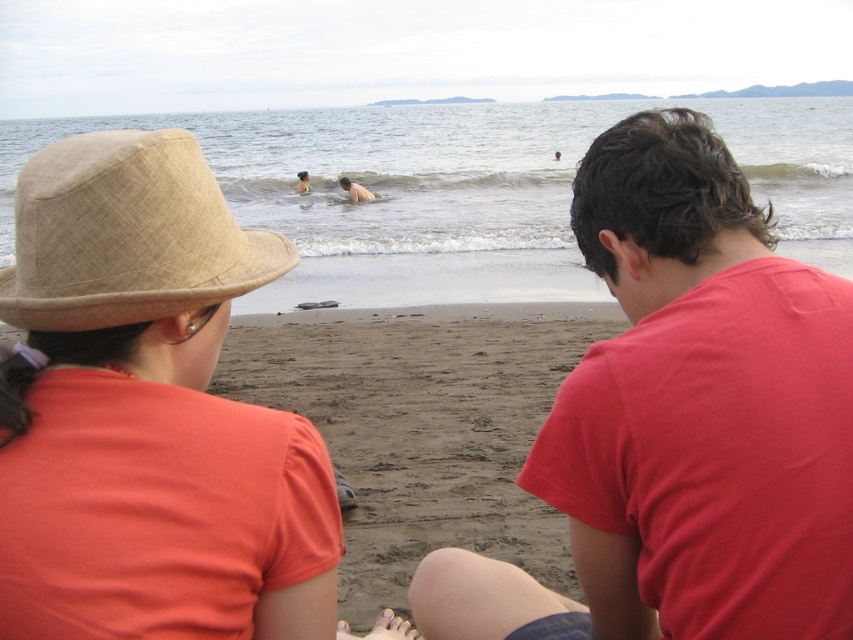
You are standing at the center of the image. Which direction should you move to reach the brown sandy beach at center?

The brown sandy beach at center is located at point coordinates of 0.667 on the x axis and 0.497 on the y axis. Since you are already at the center of the image, you are already standing on the brown sandy beach at center.

Consider the image. You are planning to set up a small tent on the brown sandy beach at center. However, there is a beige woven hat at upper left nearby. Based on the scene, can the tent be placed between these two objects without overlapping them?

The brown sandy beach at center might be wider than beige woven hat at upper left, so there might be enough space to place the tent between them without overlapping. However, the exact distance isn

You are a photographer trying to capture the perfect shot of the two people on the brown sandy beach at center and the naked skin at center. Since you want to include both subjects in the frame, which subject should you position closer to the left side of the camera to ensure both fit in the shot?

The brown sandy beach at center is to the right of the naked skin at center, so positioning the naked skin at center closer to the left side of the camera will allow both subjects to fit in the frame.